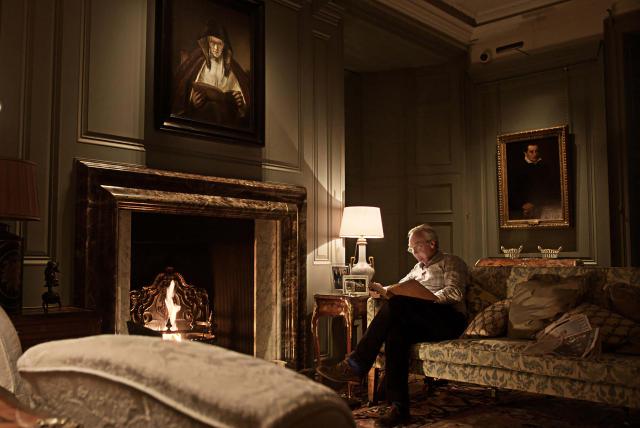
The image size is (640, 428). Find the location of `lamp shade`. lamp shade is located at coordinates (363, 219), (25, 199).